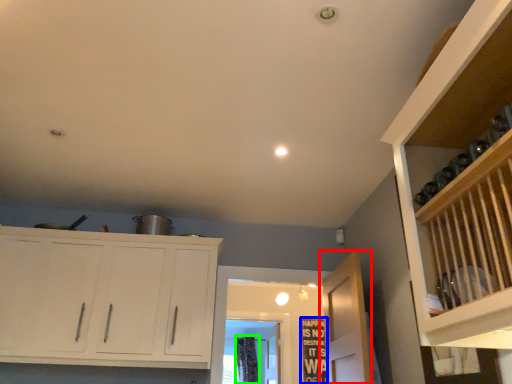
Question: Which is nearer to the door (highlighted by a red box)? bulletin board (highlighted by a blue box) or curtain (highlighted by a green box).

Choices:
 (A) bulletin board
 (B) curtain

Answer: (A)